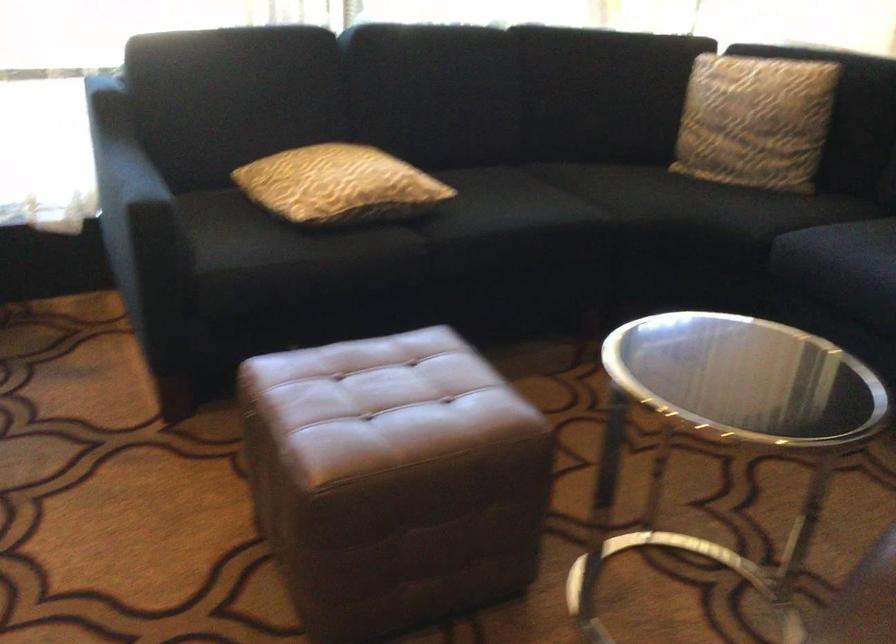
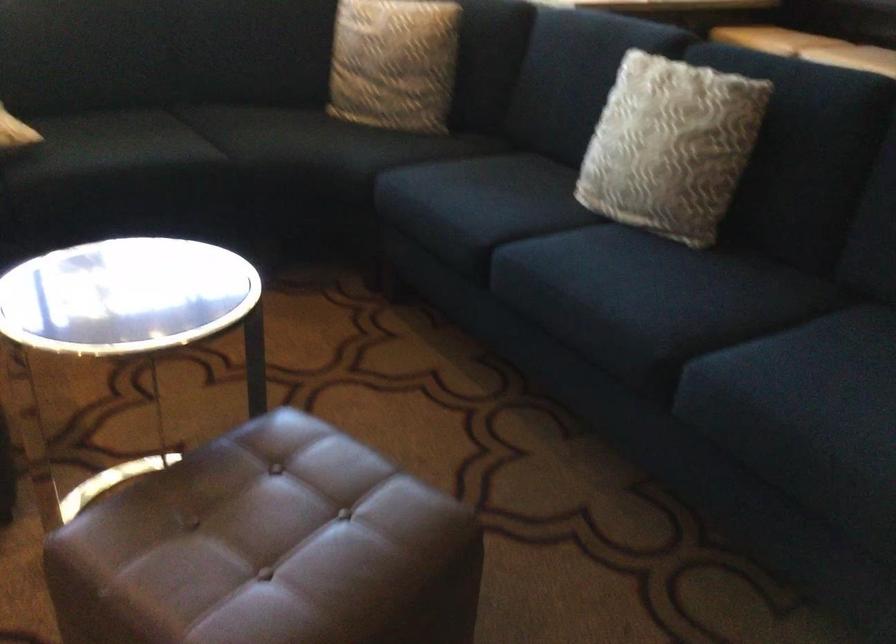
Question: The first image is from the beginning of the video and the second image is from the end. How did the camera likely rotate when shooting the video?

Choices:
 (A) Left
 (B) Right
 (C) Up
 (D) Down

Answer: (B)